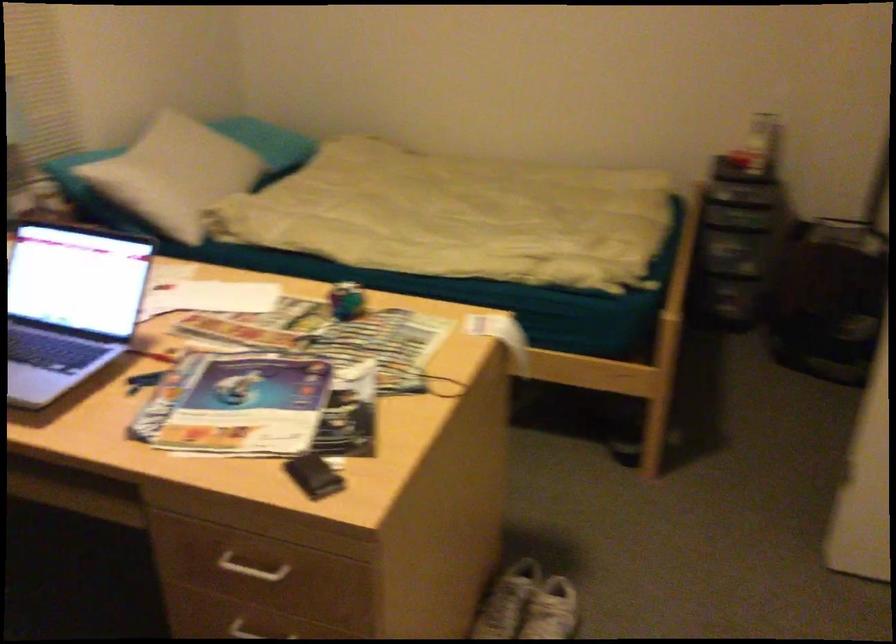
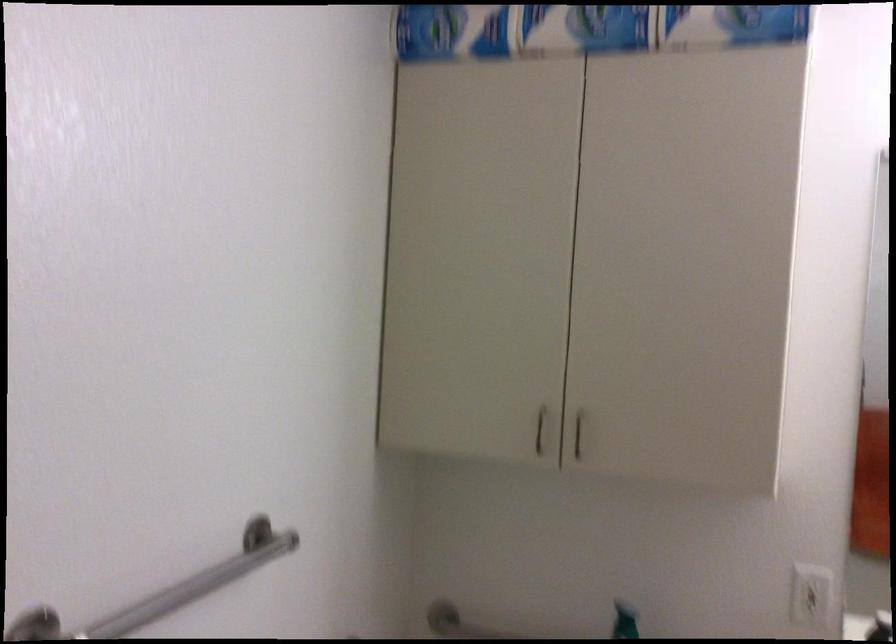
Question: In a continuous first-person perspective shot, in which direction is the camera moving?

Choices:
 (A) Left
 (B) Right
 (C) Forward
 (D) Backward

Answer: (B)